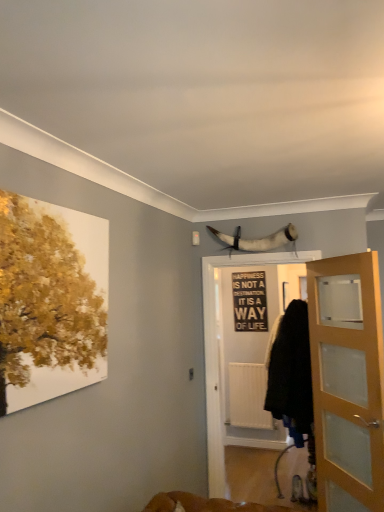
Question: Relative to black fabric screen door at center, is white matte radiator at center in front or behind?

Choices:
 (A) behind
 (B) front

Answer: (A)

Question: Considering the positions of white matte radiator at center and black fabric screen door at center in the image, is white matte radiator at center bigger or smaller than black fabric screen door at center?

Choices:
 (A) small
 (B) big

Answer: (A)

Question: Considering the real-world distances, which object is closest to the white matte radiator at center?

Choices:
 (A) black matte signboard at center
 (B) white horn at upper center
 (C) black fabric screen door at center
 (D) light brown wooden door at right

Answer: (A)

Question: Based on their relative distances, which object is nearer to the white matte radiator at center?

Choices:
 (A) black fabric screen door at center
 (B) light brown wooden door at right
 (C) black matte signboard at center
 (D) white horn at upper center

Answer: (C)